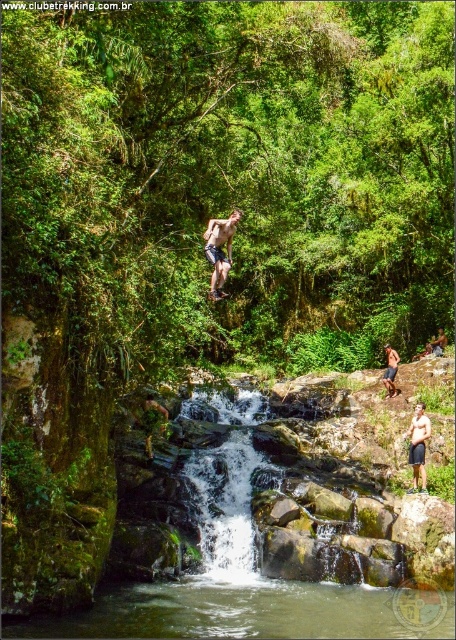
You are a photographer positioned at the edge of the cliff, aiming to capture a clear photo of the shiny metallic shorts at center and the smooth skin man at center. Which object should you focus on first to ensure both are in focus?

The shiny metallic shorts at center is in front of the smooth skin man at center, so you should focus on the shiny metallic shorts at center first to ensure both are in focus.

You are a photographer positioned at the edge of the cliff, aiming to capture both the tan skin human at center and the smooth skin man at center in a single frame. Based on their sizes, which person will appear closer to the camera in the photo?

The tan skin human at center will appear closer to the camera because objects that are larger in the frame typically indicate they are nearer to the viewer.